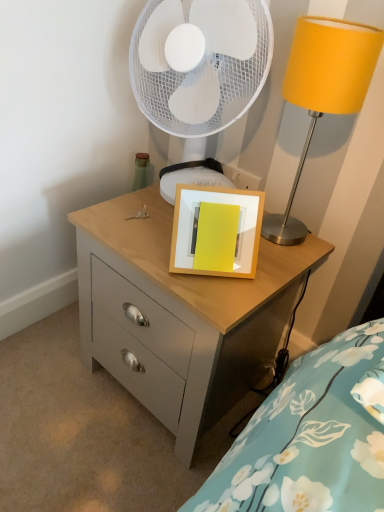
Question: Is matte wood chest of drawers at center in front of or behind white mesh mechanical fan at upper center in the image?

Choices:
 (A) front
 (B) behind

Answer: (A)

Question: Is matte wood chest of drawers at center spatially inside white mesh mechanical fan at upper center, or outside of it?

Choices:
 (A) outside
 (B) inside

Answer: (A)

Question: Which is farther from the wooden picture frame at center?

Choices:
 (A) white mesh mechanical fan at upper center
 (B) metallic yellow lampshade at upper right
 (C) matte wood chest of drawers at center

Answer: (A)

Question: Estimate the real-world distances between objects in this image. Which object is closer to the wooden picture frame at center?

Choices:
 (A) metallic yellow lampshade at upper right
 (B) white mesh mechanical fan at upper center
 (C) matte wood chest of drawers at center

Answer: (C)